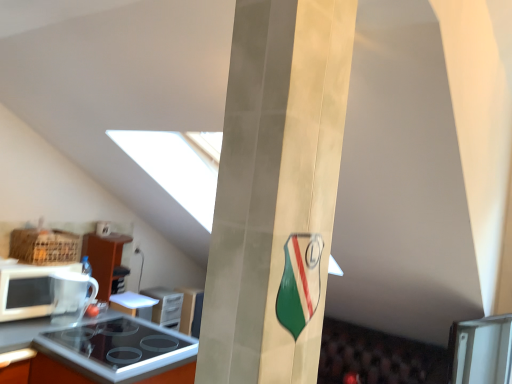
The image size is (512, 384). Identify the location of black glass stove at lower left, which is counted as the third appliance, starting from the front. (165, 306).

The image size is (512, 384). I want to click on matte gold pillar at center, so (x=276, y=191).

What is the approximate width of matte gold pillar at center?

matte gold pillar at center is 7.72 inches wide.

What do you see at coordinates (71, 295) in the screenshot? I see `transparent glass mug at lower left, acting as the third appliance starting from the back` at bounding box center [71, 295].

Identify the location of transparent glass mug at lower left, acting as the third appliance starting from the back. Image resolution: width=512 pixels, height=384 pixels. (x=71, y=295).

What do you see at coordinates (28, 290) in the screenshot? This screenshot has width=512, height=384. I see `white glossy microwave at left` at bounding box center [28, 290].

Identify the location of orange laminate countertop at lower left. (101, 351).

Where is `white glossy plate at lower center, arranged as the second appliance when viewed from the front`? white glossy plate at lower center, arranged as the second appliance when viewed from the front is located at coordinates (133, 304).

Considering the relative sizes of white glossy microwave at left and orange laminate countertop at lower left in the image provided, is white glossy microwave at left bigger than orange laminate countertop at lower left?

Actually, white glossy microwave at left might be smaller than orange laminate countertop at lower left.

Find the location of `countertop below the white glossy microwave at left (from the image's perspective)`. countertop below the white glossy microwave at left (from the image's perspective) is located at coordinates (101, 351).

Considering the relative sizes of white glossy microwave at left and orange laminate countertop at lower left in the image provided, is white glossy microwave at left thinner than orange laminate countertop at lower left?

Indeed, white glossy microwave at left has a lesser width compared to orange laminate countertop at lower left.

From a real-world perspective, between white glossy microwave at left and orange laminate countertop at lower left, who is vertically lower?

In real-world perspective, orange laminate countertop at lower left is lower.

Would you consider white glossy microwave at left to be distant from matte gold pillar at center?

That's right, there is a large distance between white glossy microwave at left and matte gold pillar at center.

Does white glossy microwave at left have a greater width compared to matte gold pillar at center?

Indeed, white glossy microwave at left has a greater width compared to matte gold pillar at center.

From a real-world perspective, is white glossy microwave at left on top of matte gold pillar at center?

No.

How many degrees apart are the facing directions of orange laminate countertop at lower left and transparent glass mug at lower left, acting as the third appliance starting from the back?

The angular difference between orange laminate countertop at lower left and transparent glass mug at lower left, acting as the third appliance starting from the back, is 89.4 degrees.

Which is correct: orange laminate countertop at lower left is inside transparent glass mug at lower left, acting as the third appliance starting from the back, or outside of it?

orange laminate countertop at lower left is located beyond the bounds of transparent glass mug at lower left, acting as the third appliance starting from the back.

From a real-world perspective, relative to transparent glass mug at lower left, placed as the 1th appliance when sorted from front to back, is orange laminate countertop at lower left vertically above or below?

orange laminate countertop at lower left is below transparent glass mug at lower left, placed as the 1th appliance when sorted from front to back.

Can you confirm if orange laminate countertop at lower left is shorter than transparent glass mug at lower left, acting as the third appliance starting from the back?

No, orange laminate countertop at lower left is not shorter than transparent glass mug at lower left, acting as the third appliance starting from the back.

Consider the image. Would you say transparent glass mug at lower left, placed as the 1th appliance when sorted from front to back, is part of white glossy plate at lower center, arranged as the second appliance when viewed from the front,'s contents?

Definitely not — transparent glass mug at lower left, placed as the 1th appliance when sorted from front to back, is not inside white glossy plate at lower center, arranged as the second appliance when viewed from the front.

Who is smaller, white glossy plate at lower center, arranged as the second appliance when viewed from the front, or transparent glass mug at lower left, placed as the 1th appliance when sorted from front to back?

Smaller between the two is white glossy plate at lower center, arranged as the second appliance when viewed from the front.

Looking at this image, from a real-world perspective, is white glossy plate at lower center, arranged as the second appliance when viewed from the front, physically located above or below transparent glass mug at lower left, placed as the 1th appliance when sorted from front to back?

From a real-world perspective, white glossy plate at lower center, arranged as the second appliance when viewed from the front, is physically below transparent glass mug at lower left, placed as the 1th appliance when sorted from front to back.

Is point (150, 317) positioned before point (75, 280)?

No, (150, 317) is further to viewer.

The height and width of the screenshot is (384, 512). What are the coordinates of `pillar located above the black glass stove at lower left, which is counted as the third appliance, starting from the front (from a real-world perspective)` in the screenshot? It's located at pyautogui.click(x=276, y=191).

Is matte gold pillar at center aimed at black glass stove at lower left, which is counted as the third appliance, starting from the front?

No, matte gold pillar at center is not facing towards black glass stove at lower left, which is counted as the third appliance, starting from the front.

In the image, is matte gold pillar at center on the left side or the right side of black glass stove at lower left, which is the 1th appliance from back to front?

matte gold pillar at center is positioned on black glass stove at lower left, which is the 1th appliance from back to front,'s right side.

Between matte gold pillar at center and black glass stove at lower left, which is counted as the third appliance, starting from the front, which one has larger size?

Bigger between the two is matte gold pillar at center.

Which object is positioned more to the left, black glass stove at lower left, which is the 1th appliance from back to front, or white glossy microwave at left?

white glossy microwave at left is more to the left.

Would you say black glass stove at lower left, which is counted as the third appliance, starting from the front, contains white glossy microwave at left?

No, white glossy microwave at left is located outside of black glass stove at lower left, which is counted as the third appliance, starting from the front.

Where is `microwave oven above the black glass stove at lower left, which is the 1th appliance from back to front (from the image's perspective)`? microwave oven above the black glass stove at lower left, which is the 1th appliance from back to front (from the image's perspective) is located at coordinates (28, 290).

Is black glass stove at lower left, which is counted as the third appliance, starting from the front, with white glossy microwave at left?

No, black glass stove at lower left, which is counted as the third appliance, starting from the front, is not with white glossy microwave at left.

Relative to transparent glass mug at lower left, placed as the 1th appliance when sorted from front to back, is black glass stove at lower left, which is the 1th appliance from back to front, in front or behind?

Visually, black glass stove at lower left, which is the 1th appliance from back to front, is located behind transparent glass mug at lower left, placed as the 1th appliance when sorted from front to back.

You are a GUI agent. You are given a task and a screenshot of the screen. Output one action in this format:
    pyautogui.click(x=<x>, y=<y>)
    Task: Click on the 2nd appliance positioned above the black glass stove at lower left, which is counted as the third appliance, starting from the front (from a real-world perspective)
    
    Given the screenshot: What is the action you would take?
    pyautogui.click(x=71, y=295)

From the image's perspective, is black glass stove at lower left, which is counted as the third appliance, starting from the front, under transparent glass mug at lower left, placed as the 1th appliance when sorted from front to back?

Yes, from the image's perspective, black glass stove at lower left, which is counted as the third appliance, starting from the front, is beneath transparent glass mug at lower left, placed as the 1th appliance when sorted from front to back.

Is black glass stove at lower left, which is the 1th appliance from back to front, positioned with its back to transparent glass mug at lower left, placed as the 1th appliance when sorted from front to back?

black glass stove at lower left, which is the 1th appliance from back to front, is not turned away from transparent glass mug at lower left, placed as the 1th appliance when sorted from front to back.

At what (x,y) coordinates should I click in order to perform the action: click on microwave oven that appears on the left of orange laminate countertop at lower left. Please return your answer as a coordinate pair (x, y). Looking at the image, I should click on (28, 290).

Find the location of `pillar that appears on the right of white glossy microwave at left`. pillar that appears on the right of white glossy microwave at left is located at coordinates (276, 191).

Considering their positions, is white glossy microwave at left positioned closer to black glass stove at lower left, which is the 1th appliance from back to front, than orange laminate countertop at lower left?

Among the two, orange laminate countertop at lower left is located nearer to black glass stove at lower left, which is the 1th appliance from back to front.

Based on their spatial positions, is white glossy plate at lower center, arranged as the second appliance when viewed from the front, or matte gold pillar at center closer to transparent glass mug at lower left, acting as the third appliance starting from the back?

white glossy plate at lower center, arranged as the second appliance when viewed from the front, lies closer to transparent glass mug at lower left, acting as the third appliance starting from the back, than the other object.

Which object lies further to the anchor point orange laminate countertop at lower left, black glass stove at lower left, which is the 1th appliance from back to front, or matte gold pillar at center?

Among the two, matte gold pillar at center is located further to orange laminate countertop at lower left.

Based on their spatial positions, is orange laminate countertop at lower left or matte gold pillar at center closer to transparent glass mug at lower left, placed as the 1th appliance when sorted from front to back?

Among the two, orange laminate countertop at lower left is located nearer to transparent glass mug at lower left, placed as the 1th appliance when sorted from front to back.

Estimate the real-world distances between objects in this image. Which object is closer to transparent glass mug at lower left, placed as the 1th appliance when sorted from front to back, white glossy plate at lower center, arranged as the second appliance when viewed from the back, or black glass stove at lower left, which is counted as the third appliance, starting from the front?

The object closer to transparent glass mug at lower left, placed as the 1th appliance when sorted from front to back, is white glossy plate at lower center, arranged as the second appliance when viewed from the back.

From the image, which object appears to be nearer to matte gold pillar at center, white glossy plate at lower center, arranged as the second appliance when viewed from the back, or white glossy microwave at left?

white glossy microwave at left lies closer to matte gold pillar at center than the other object.

Based on their spatial positions, is matte gold pillar at center or white glossy plate at lower center, arranged as the second appliance when viewed from the front, further from black glass stove at lower left, which is counted as the third appliance, starting from the front?

matte gold pillar at center lies further to black glass stove at lower left, which is counted as the third appliance, starting from the front, than the other object.

From the image, which object appears to be nearer to white glossy microwave at left, white glossy plate at lower center, arranged as the second appliance when viewed from the back, or black glass stove at lower left, which is counted as the third appliance, starting from the front?

The object closer to white glossy microwave at left is white glossy plate at lower center, arranged as the second appliance when viewed from the back.

Identify the location of microwave oven located between orange laminate countertop at lower left and black glass stove at lower left, which is counted as the third appliance, starting from the front, in the depth direction. (28, 290).

Where is `countertop between matte gold pillar at center and white glossy plate at lower center, arranged as the second appliance when viewed from the front, in the front-back direction`? The height and width of the screenshot is (384, 512). countertop between matte gold pillar at center and white glossy plate at lower center, arranged as the second appliance when viewed from the front, in the front-back direction is located at coordinates (101, 351).

The width and height of the screenshot is (512, 384). I want to click on appliance between matte gold pillar at center and white glossy plate at lower center, arranged as the second appliance when viewed from the front, along the z-axis, so click(x=71, y=295).

Locate an element on the screen. appliance positioned between transparent glass mug at lower left, placed as the 1th appliance when sorted from front to back, and black glass stove at lower left, which is counted as the third appliance, starting from the front, from near to far is located at coordinates (133, 304).